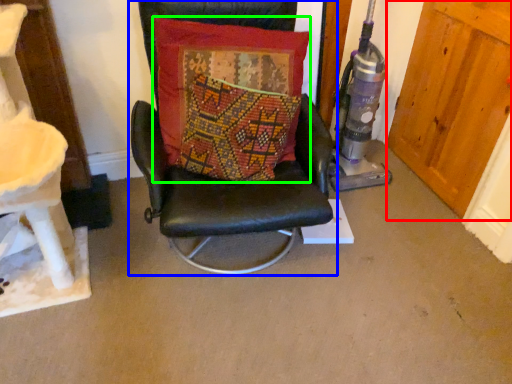
Question: Estimate the real-world distances between objects in this image. Which object is closer to door (highlighted by a red box), chair (highlighted by a blue box) or pillow (highlighted by a green box)?

Choices:
 (A) chair
 (B) pillow

Answer: (A)